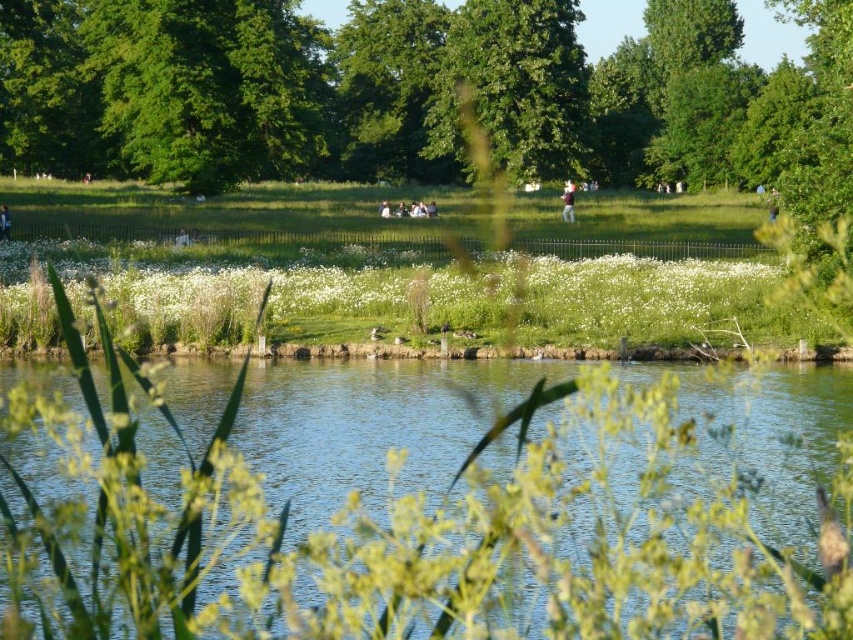
Question: Is green grassy river at center closer to camera compared to green leafy tree at center?

Choices:
 (A) no
 (B) yes

Answer: (B)

Question: Considering the relative positions of green grassy river at center and light brown fabric shirt at center in the image provided, where is green grassy river at center located with respect to light brown fabric shirt at center?

Choices:
 (A) left
 (B) right

Answer: (A)

Question: Is green grassy river at center above green grass at center?

Choices:
 (A) no
 (B) yes

Answer: (A)

Question: Considering the real-world distances, which object is farthest from the green leafy tree at center?

Choices:
 (A) green grassy river at center
 (B) light brown fabric shirt at center
 (C) light brown wooden stick at lower left
 (D) green grass at center

Answer: (A)

Question: Among these points, which one is farthest from the camera?

Choices:
 (A) (651, 412)
 (B) (572, 192)
 (C) (432, 132)
 (D) (131, 230)

Answer: (C)

Question: Which of the following is the farthest from the observer?

Choices:
 (A) pos(465,83)
 (B) pos(698,484)
 (C) pos(7,216)

Answer: (A)